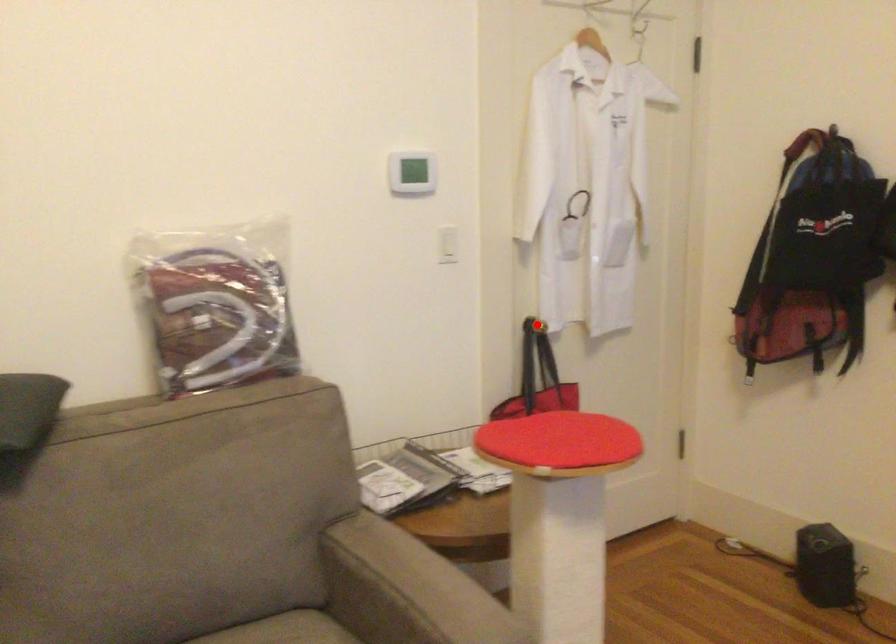
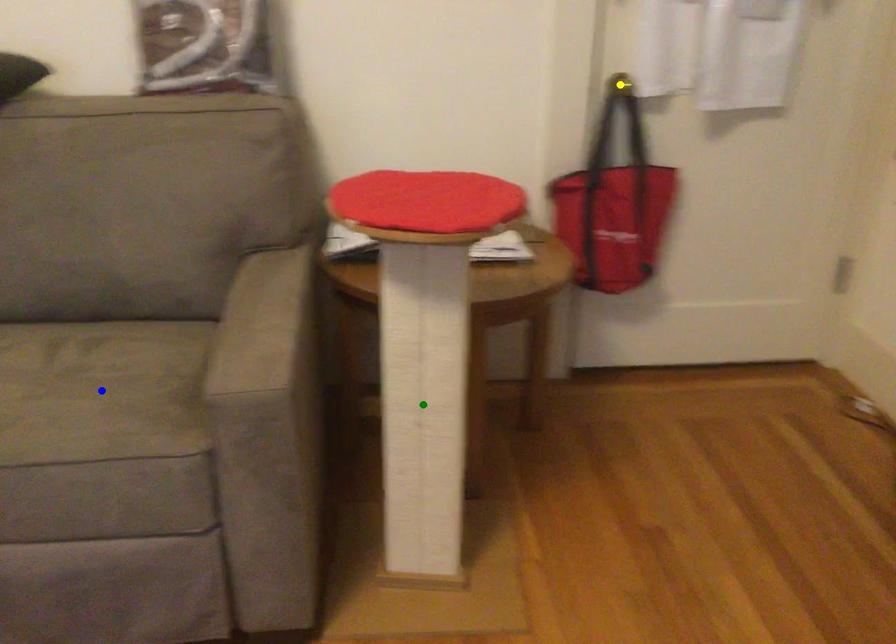
Question: I am providing you with two images of the same scene from different viewpoints. A red point is marked on the first image. You are given multiple points on the second image. Which point in image 2 is actually the same real-world point as the red point in image 1?

Choices:
 (A) yellow point
 (B) blue point
 (C) green point

Answer: (A)